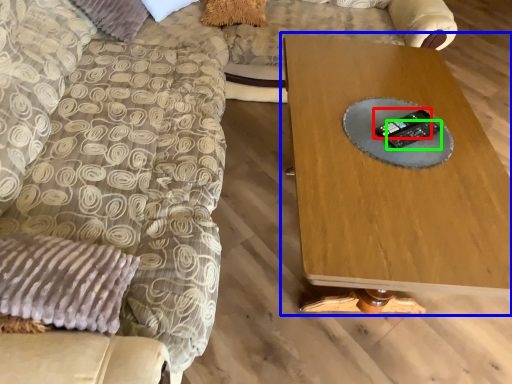
Question: Which object is the closest to the control (highlighted by a red box)? Choose among these: table (highlighted by a blue box) or control (highlighted by a green box).

Choices:
 (A) table
 (B) control

Answer: (B)